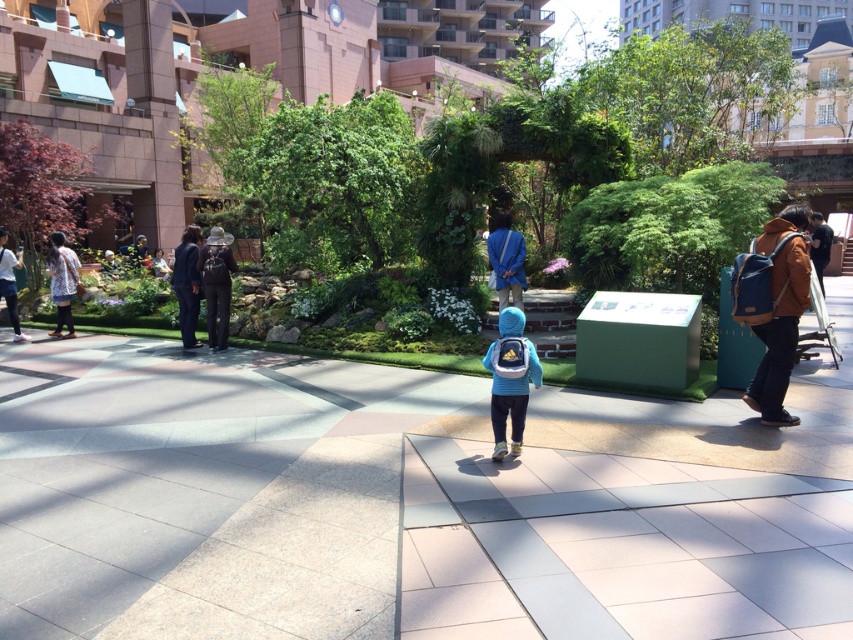
You are standing at the point labeled point [614,412] and want to walk to the point labeled point [831,234]. Which direction should you move to get closer to your destination?

You should move backward because point [614,412] is closer to the camera than point [831,234], so moving away from the camera will bring you closer to the destination.

You are standing at the point marked as point (405, 502) in the scene. What type of surface are you standing on?

You are standing on a smooth concrete path at center.

You are a photographer trying to capture a clear photo of the matte blue backpack at center and the light blue fabric jacket at center. Since you want both items to be clearly visible, which one should you zoom in on more?

The matte blue backpack at center has a larger size compared to the light blue fabric jacket at center, so you should zoom in more on the light blue fabric jacket at center to ensure it appears as detailed as the larger backpack.